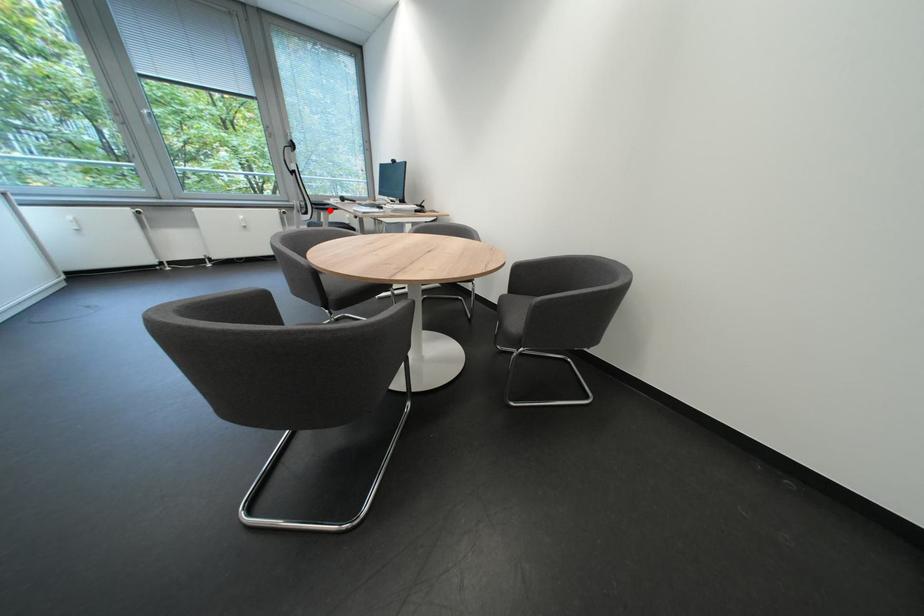
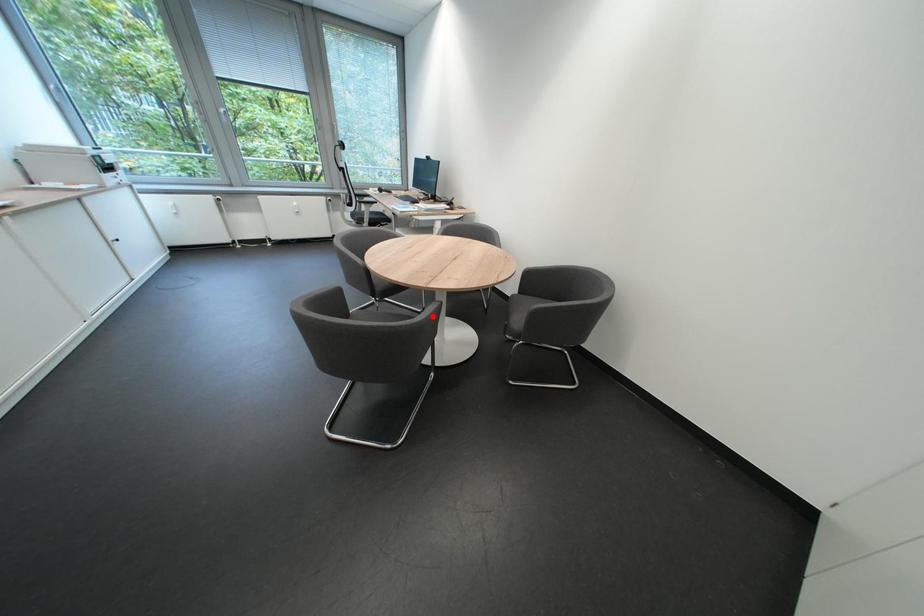
I am providing you with two images of the same scene from different viewpoints. A red point is marked on the first image and another point is marked on the second image. Do the highlighted points in image1 and image2 indicate the same real-world spot?

No